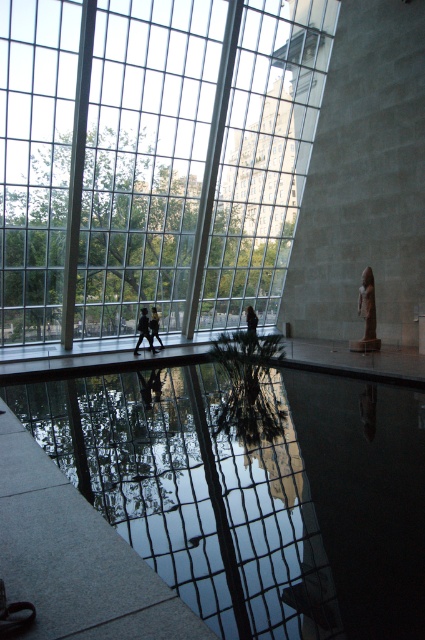
This screenshot has height=640, width=425. What do you see at coordinates (367, 314) in the screenshot?
I see `matte brown statue at right` at bounding box center [367, 314].

Image resolution: width=425 pixels, height=640 pixels. Find the location of `matte brown statue at right`. matte brown statue at right is located at coordinates (367, 314).

Can you confirm if matte black suit at center is positioned below dark hair person at center?

Yes.

How far apart are matte black suit at center and dark hair person at center?

matte black suit at center and dark hair person at center are 4.50 meters apart.

Who is more distant from viewer, (135, 349) or (252, 324)?

The point (252, 324) is more distant.

The width and height of the screenshot is (425, 640). In order to click on matte black suit at center in this screenshot , I will do `click(144, 332)`.

Can you confirm if transparent glass pool at center is positioned to the left of matte black suit at center?

No, transparent glass pool at center is not to the left of matte black suit at center.

Is transparent glass pool at center above matte black suit at center?

Actually, transparent glass pool at center is below matte black suit at center.

Between point (130, 483) and point (150, 348), which one is positioned behind?

The point (150, 348) is more distant.

Identify the location of transparent glass pool at center. (252, 490).